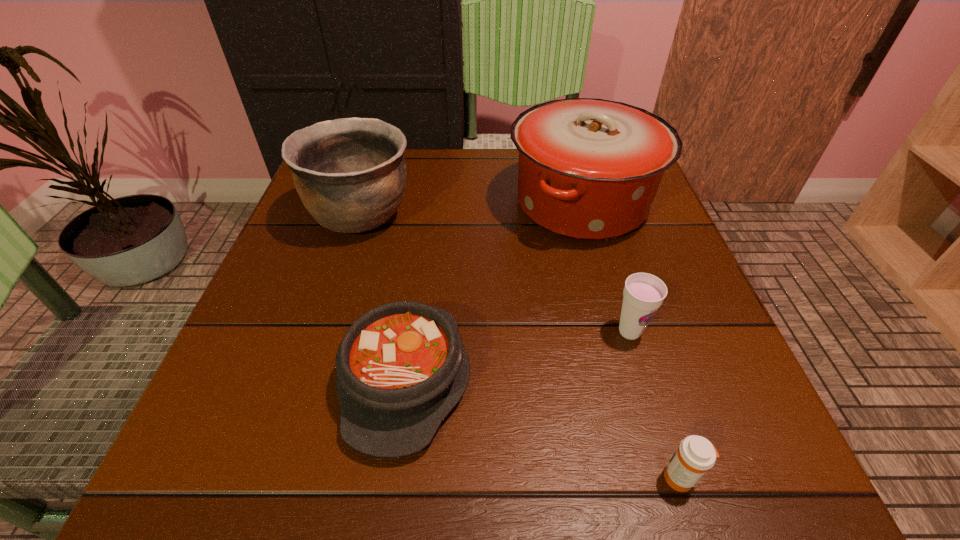
At what (x,y) coordinates should I click in order to perform the action: click on the right casserole. Please return your answer as a coordinate pair (x, y). The image size is (960, 540). Looking at the image, I should click on (589, 169).

Where is `the farther casserole`? the farther casserole is located at coordinates (589, 169).

Locate an element on the screen. pottery is located at coordinates (350, 173).

In order to click on cup in this screenshot , I will do `click(643, 294)`.

The height and width of the screenshot is (540, 960). I want to click on the left casserole, so click(401, 367).

The width and height of the screenshot is (960, 540). Find the location of `the nearer casserole`. the nearer casserole is located at coordinates pos(401,367).

This screenshot has height=540, width=960. Find the location of `medicine`. medicine is located at coordinates (695, 455).

Where is `vacant space located 0.090m on the front of the tallest object`? vacant space located 0.090m on the front of the tallest object is located at coordinates (604, 286).

The image size is (960, 540). Find the location of `free space located 0.160m on the front of the pottery`. free space located 0.160m on the front of the pottery is located at coordinates (331, 312).

Image resolution: width=960 pixels, height=540 pixels. What are the coordinates of `free space located on the back of the third tallest object` in the screenshot? It's located at (589, 199).